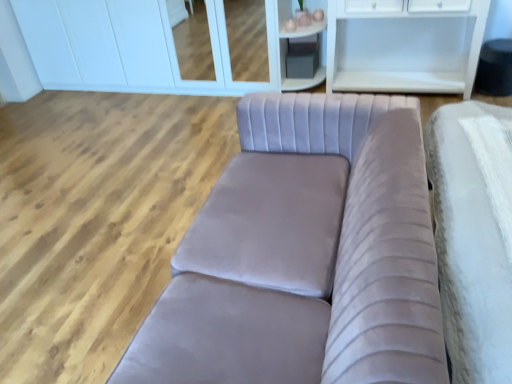
Where is `free space to the left of velvet grey couch at center`? Image resolution: width=512 pixels, height=384 pixels. free space to the left of velvet grey couch at center is located at coordinates (85, 277).